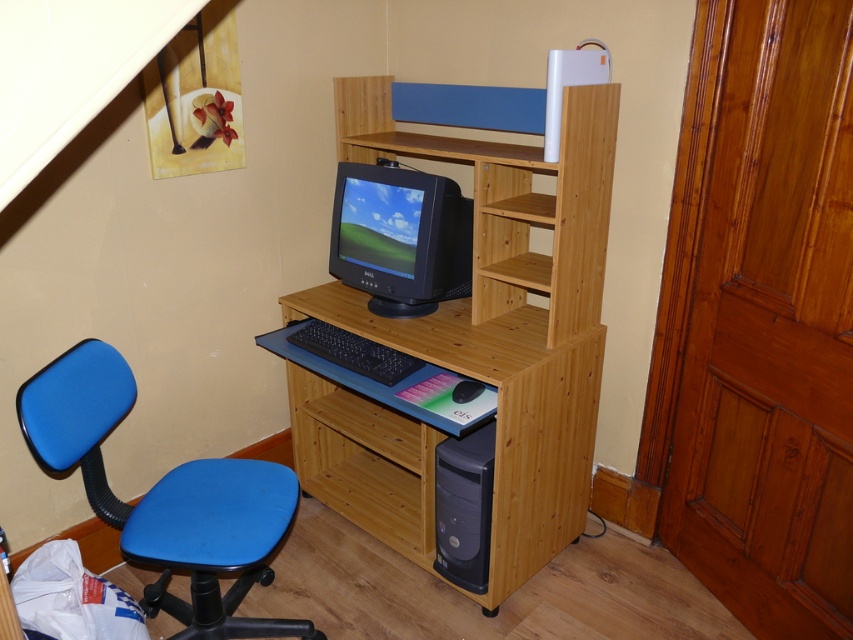
Question: Among these points, which one is nearest to the camera?

Choices:
 (A) (450, 458)
 (B) (381, 355)
 (C) (103, 349)
 (D) (573, 332)

Answer: (C)

Question: Among these points, which one is farthest from the camera?

Choices:
 (A) 280,509
 (B) 401,228
 (C) 473,465

Answer: (B)

Question: Can you confirm if natural wood shelf at center is wider than black plastic computer at lower right?

Choices:
 (A) no
 (B) yes

Answer: (B)

Question: In this image, where is blue fabric office chair at left located relative to black plastic computer at lower right?

Choices:
 (A) below
 (B) above

Answer: (B)

Question: Among these objects, which one is farthest from the camera?

Choices:
 (A) blue fabric office chair at left
 (B) matte black monitor at center
 (C) natural wood computer desk at center
 (D) black plastic computer at lower right

Answer: (B)

Question: Is natural wood shelf at center smaller than black plastic keyboard at center?

Choices:
 (A) no
 (B) yes

Answer: (A)